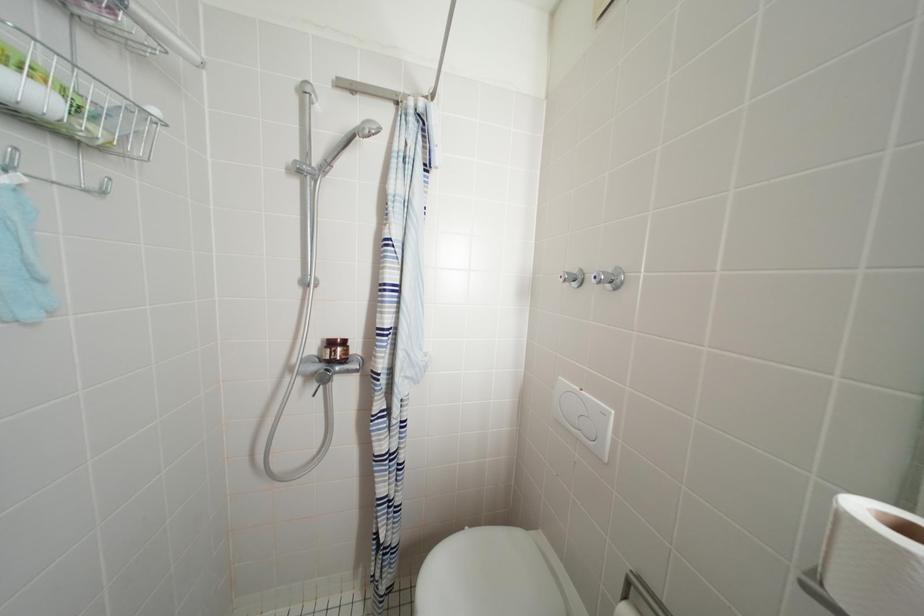
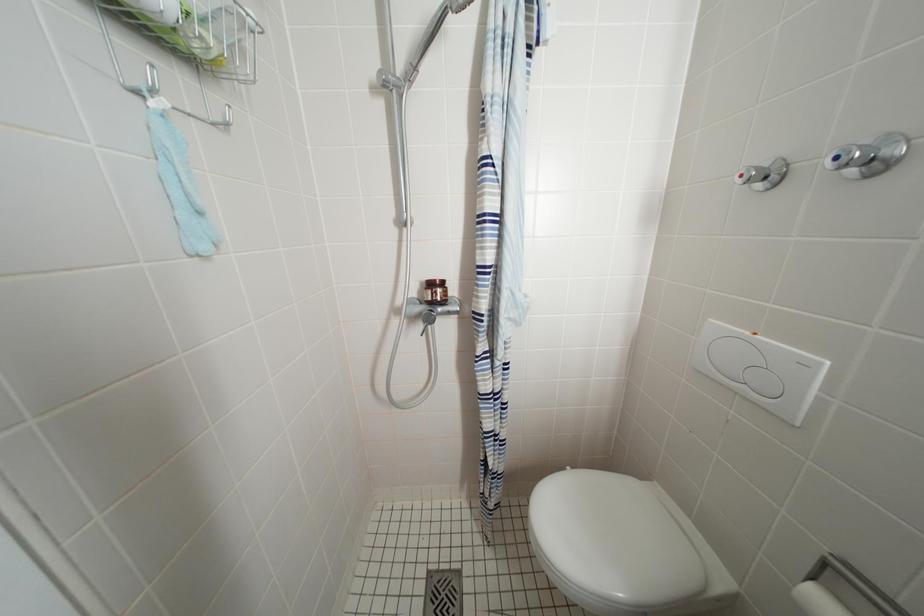
Which direction would the cameraman need to move to produce the second image?

The cameraman moved toward left, forward.